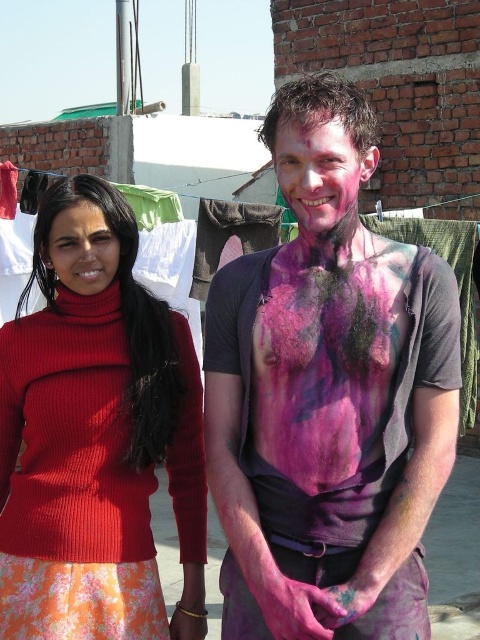
Question: Is painted skin body at center thinner than pink matte face at center?

Choices:
 (A) yes
 (B) no

Answer: (B)

Question: Which of the following is the farthest from the observer?

Choices:
 (A) matte red sweater at left
 (B) painted skin body at center

Answer: (A)

Question: Which object is farther from the camera taking this photo?

Choices:
 (A) knitted red sweater at left
 (B) matte red sweater at left
 (C) pink matte face at center
 (D) painted skin body at center

Answer: (B)

Question: Does pink matte face at center have a larger size compared to matte red sweater at left?

Choices:
 (A) yes
 (B) no

Answer: (A)

Question: Among these points, which one is farthest from the camera?

Choices:
 (A) (93, 484)
 (B) (105, 282)

Answer: (B)

Question: Is knitted red sweater at left to the left of pink matte face at center from the viewer's perspective?

Choices:
 (A) yes
 (B) no

Answer: (A)